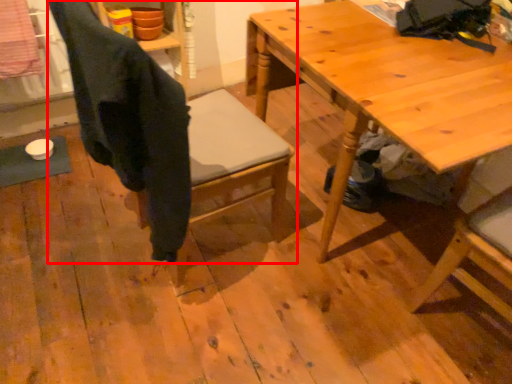
Question: Considering the relative positions of chair (annotated by the red box) and table in the image provided, where is chair (annotated by the red box) located with respect to the staircase?

Choices:
 (A) left
 (B) right

Answer: (A)